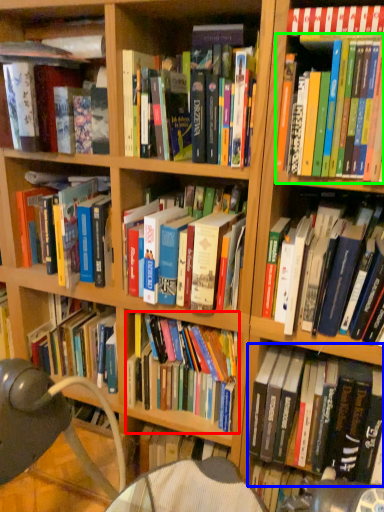
Question: Which object is the farthest from book (highlighted by a red box)? Choose among these: book (highlighted by a blue box) or book (highlighted by a green box).

Choices:
 (A) book
 (B) book

Answer: (B)